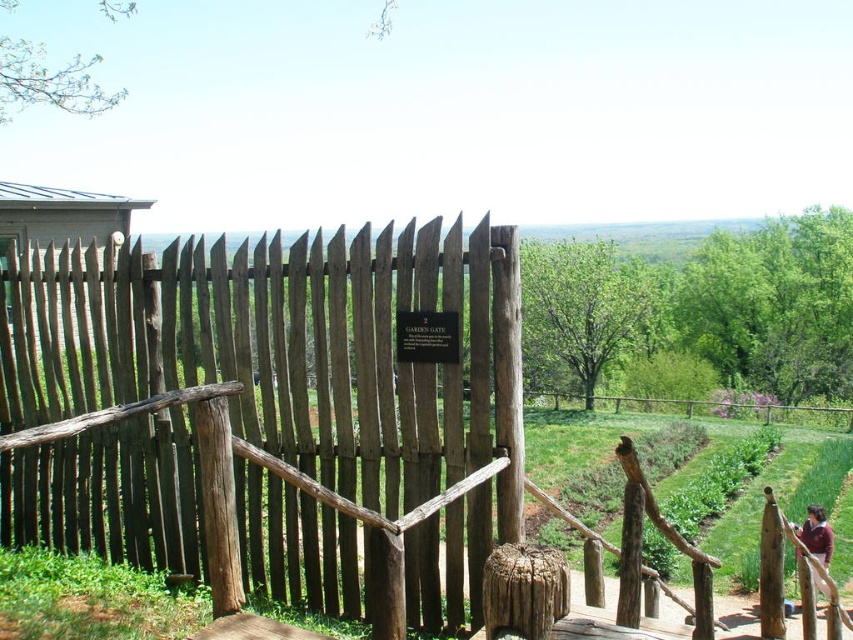
Which is in front, point (308, 250) or point (811, 513)?

Point (308, 250) is more forward.

Can you confirm if gray wooden fence at center is positioned above maroon fabric at lower right?

Correct, gray wooden fence at center is located above maroon fabric at lower right.

Between point (416, 394) and point (807, 522), which one is positioned in front?

Point (416, 394) is more forward.

Locate an element on the screen. The image size is (853, 640). gray wooden fence at center is located at coordinates pos(271,416).